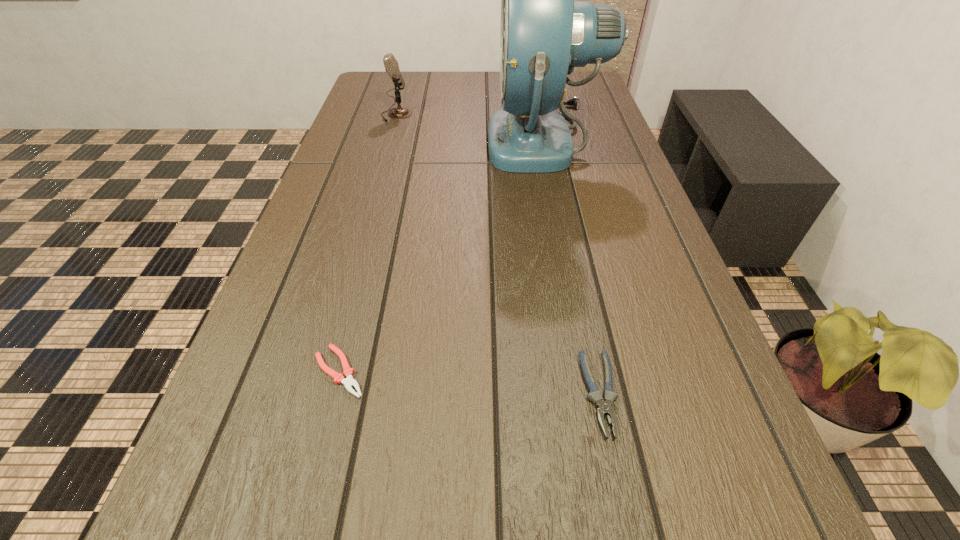
Identify which object is the nearest to the second tallest object. Please provide its 2D coordinates. Your answer should be formatted as a tuple, i.e. [(x, y)], where the tuple contains the x and y coordinates of a point satisfying the conditions above.

[(544, 34)]

Locate an element on the screen. This screenshot has width=960, height=540. free spot that satisfies the following two spatial constraints: 1. on the front-facing side of the second tallest object; 2. on the left side of the shortest object is located at coordinates (324, 372).

Identify the location of vacant space that satisfies the following two spatial constraints: 1. on the front-facing side of the third shortest object; 2. on the left side of the left pliers. (324, 372).

Find the location of a particular element. The height and width of the screenshot is (540, 960). vacant space that satisfies the following two spatial constraints: 1. on the back side of the left pliers; 2. on the front-facing side of the second tallest object is located at coordinates (405, 115).